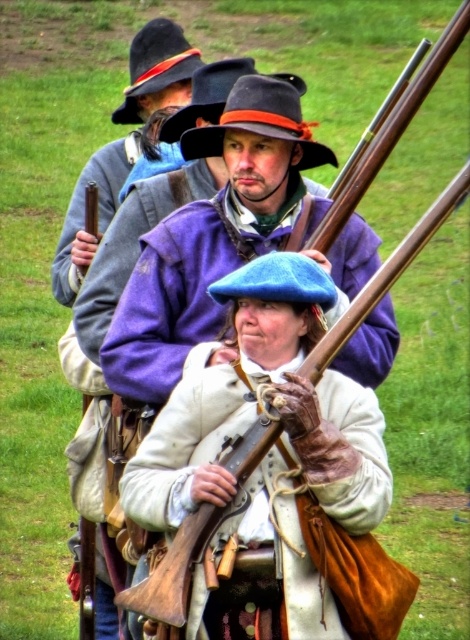
Is blue felt beret at center thinner than blue felt beret at upper center?

Indeed, blue felt beret at center has a lesser width compared to blue felt beret at upper center.

Is blue felt beret at center below blue felt beret at upper center?

Correct, blue felt beret at center is located below blue felt beret at upper center.

Who is more distant from viewer, (263, 128) or (180, 28)?

Point (180, 28)

Identify the location of blue felt beret at center. (259, 120).

Who is higher up, matte purple coat at center or blue felt beret at upper center?

blue felt beret at upper center

Does point (196, 264) come in front of point (170, 48)?

Yes, it is in front of point (170, 48).

Between point (327, 154) and point (163, 68), which one is positioned behind?

Positioned behind is point (163, 68).

Image resolution: width=470 pixels, height=640 pixels. Identify the location of matte purple coat at center. (211, 240).

Is matte purple coat at center below blue felt beret at center?

Correct, matte purple coat at center is located below blue felt beret at center.

You are a GUI agent. You are given a task and a screenshot of the screen. Output one action in this format:
    pyautogui.click(x=<x>, y=<y>)
    Task: Click on the matte purple coat at center
    This screenshot has width=470, height=640.
    Given the screenshot: What is the action you would take?
    pos(211,240)